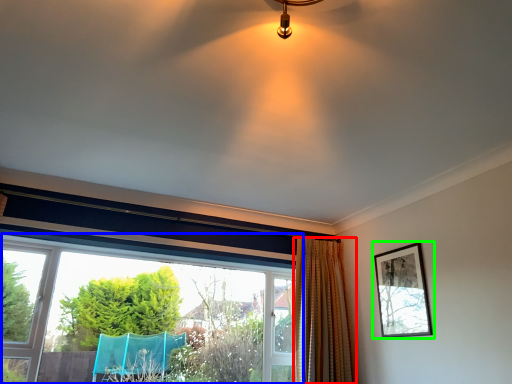
Question: Which is farther away from curtain (highlighted by a red box)? window (highlighted by a blue box) or picture frame (highlighted by a green box)?

Choices:
 (A) window
 (B) picture frame

Answer: (A)